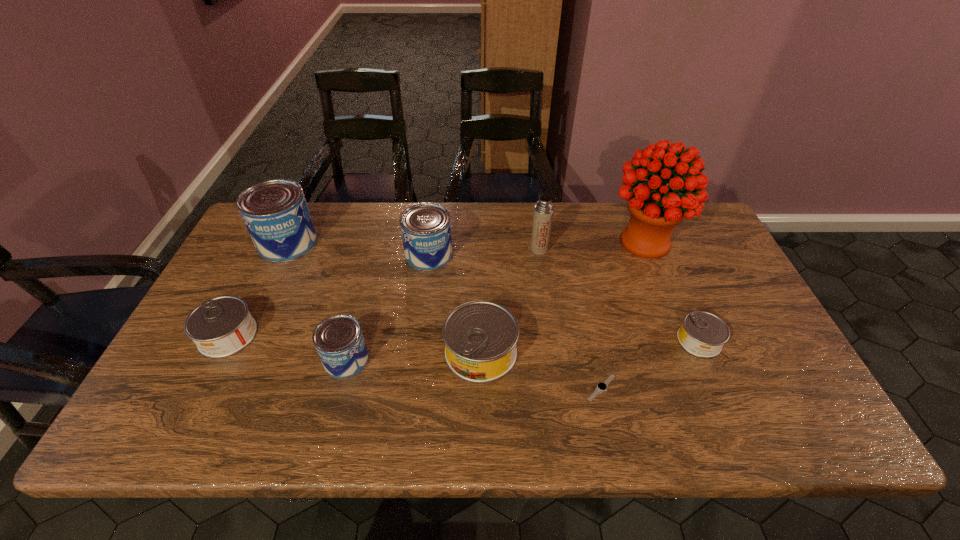
In the image, there is a desktop. In order to click on vacant space at the far edge in this screenshot , I will do point(492,237).

Where is `free space at the near edge of the desktop`? The image size is (960, 540). free space at the near edge of the desktop is located at coordinates (556, 425).

Identify the location of free location at the left edge of the desktop. Image resolution: width=960 pixels, height=540 pixels. (245, 273).

You are a GUI agent. You are given a task and a screenshot of the screen. Output one action in this format:
    pyautogui.click(x=<x>, y=<y>)
    Task: Click on the free space at the right edge of the desktop
    The image size is (960, 540).
    Given the screenshot: What is the action you would take?
    pyautogui.click(x=704, y=309)

The image size is (960, 540). In the image, there is a desktop. In order to click on vacant space at the far right corner in this screenshot , I will do `click(672, 237)`.

In the image, there is a desktop. In order to click on vacant space at the near right corner in this screenshot , I will do `click(781, 422)`.

At what (x,y) coordinates should I click in order to perform the action: click on vacant area that lies between the shortest can and the second tallest can. Please return your answer as a coordinate pair (x, y). This screenshot has width=960, height=540. Looking at the image, I should click on (564, 298).

At what (x,y) coordinates should I click in order to perform the action: click on free space between the tallest can and the second silver can from left to right. Please return your answer as a coordinate pair (x, y). The width and height of the screenshot is (960, 540). Looking at the image, I should click on (384, 298).

Where is `blank region between the tallest object and the seventh object from left to right`? The width and height of the screenshot is (960, 540). blank region between the tallest object and the seventh object from left to right is located at coordinates (623, 315).

Locate an element on the screen. This screenshot has width=960, height=540. unoccupied position between the second silver can from left to right and the third can from left to right is located at coordinates (414, 356).